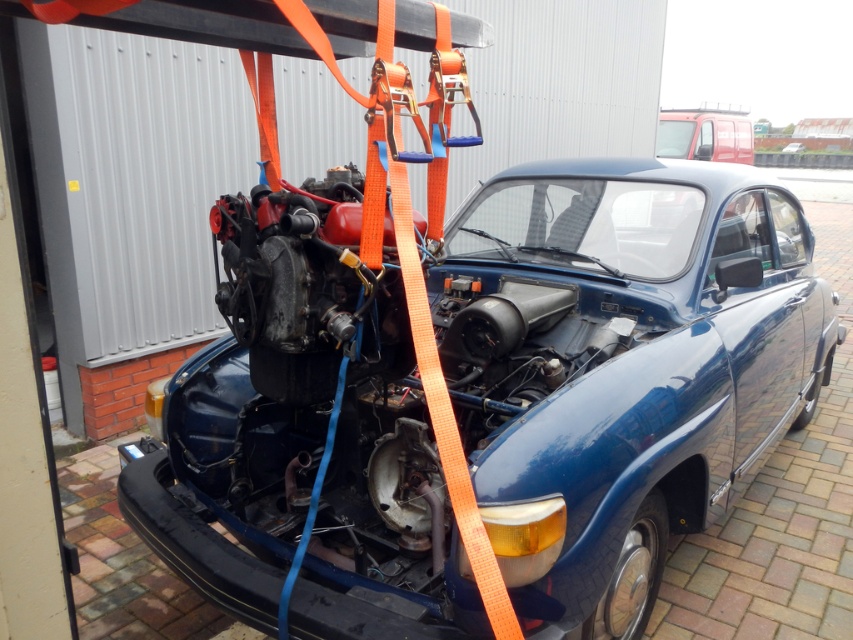
Where is `glossy blue car at center`? Image resolution: width=853 pixels, height=640 pixels. glossy blue car at center is located at coordinates (621, 365).

Who is higher up, glossy blue car at center or blue matte car at center?

blue matte car at center is higher up.

Which is behind, point (581, 300) or point (798, 150)?

The point (798, 150) is more distant.

This screenshot has height=640, width=853. Identify the location of glossy blue car at center. (621, 365).